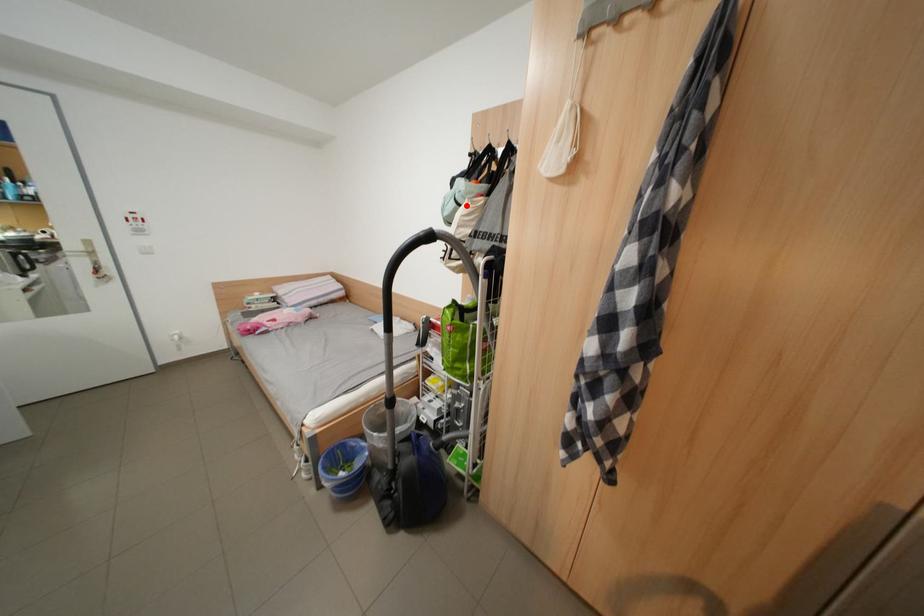
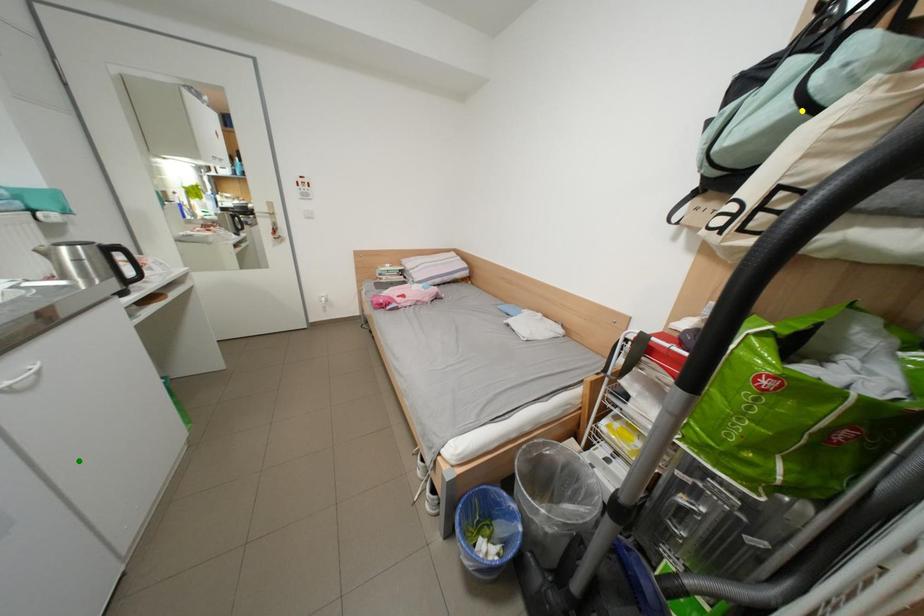
Question: I am providing you with two images of the same scene from different viewpoints. A red point is marked on the first image. You are given multiple points on the second image. Which mark in image 2 goes with the point in image 1?

Choices:
 (A) blue point
 (B) green point
 (C) yellow point

Answer: (C)